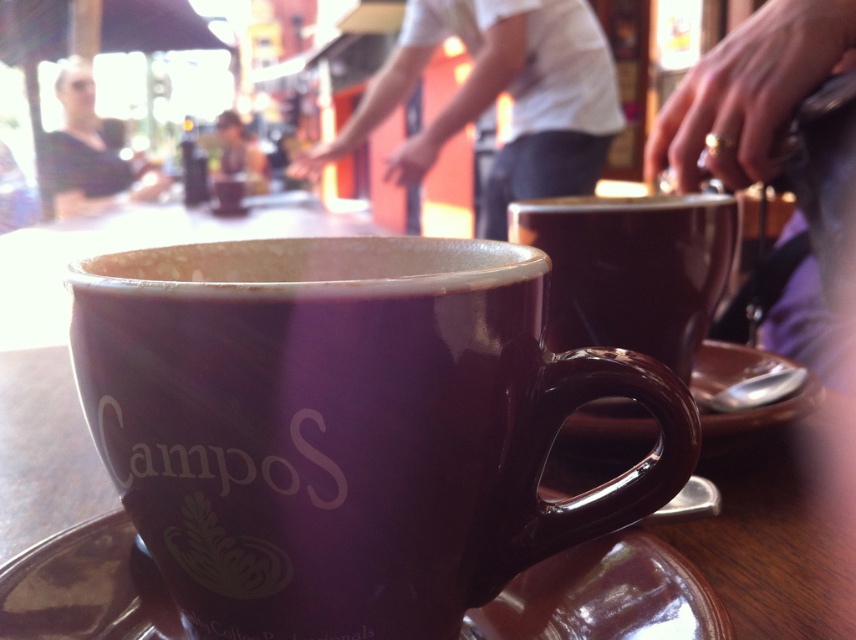
From the picture: You are a photographer standing at the camera position. You want to place a 12 inch ruler between the gold ring at upper right and the camera to measure the distance. Can you fit the ruler in that space?

The distance between the gold ring at upper right and the camera is 23.95 inches, so yes, the 12 inch ruler can fit in that space since it is shorter than the available distance.

You are a jeweler who needs to place the gold ring at upper right onto the brown ceramic saucer at center. Based on their sizes, will the ring fit on the saucer?

The gold ring at upper right is thinner than the brown ceramic saucer at center, so it should fit as the saucer is wider.

You are a barista trying to place a new coffee cup on the counter. The cup you want to place is 12 inches in diameter. You see the brown ceramic saucer at lower center. Can you fit the new cup on the saucer?

The brown ceramic saucer at lower center is 11.96 inches from viewer. Since the saucer is only 11.96 inches in diameter, which is slightly smaller than the 12 inch cup, the cup will not fit on the saucer.